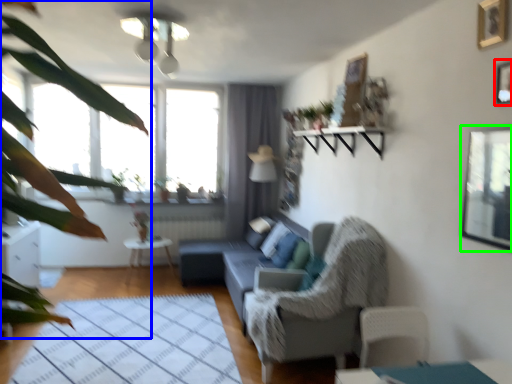
Question: Which is nearer to the picture frame (highlighted by a red box)? vegetation (highlighted by a blue box) or window screen (highlighted by a green box).

Choices:
 (A) vegetation
 (B) window screen

Answer: (B)